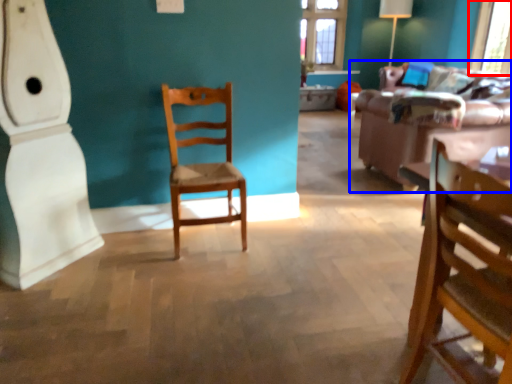
Question: Which object appears farthest to the camera in this image, window screen (highlighted by a red box) or studio couch (highlighted by a blue box)?

Choices:
 (A) window screen
 (B) studio couch

Answer: (A)